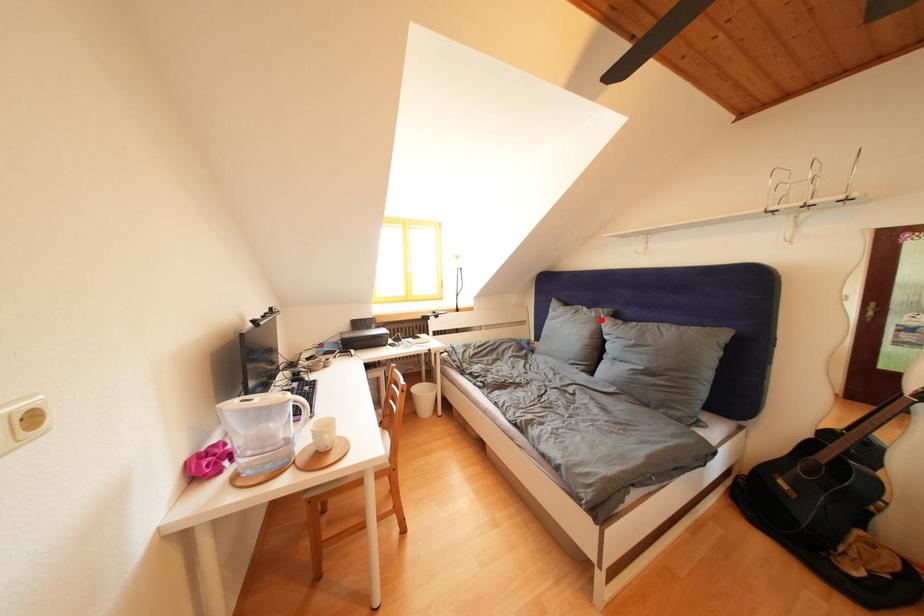
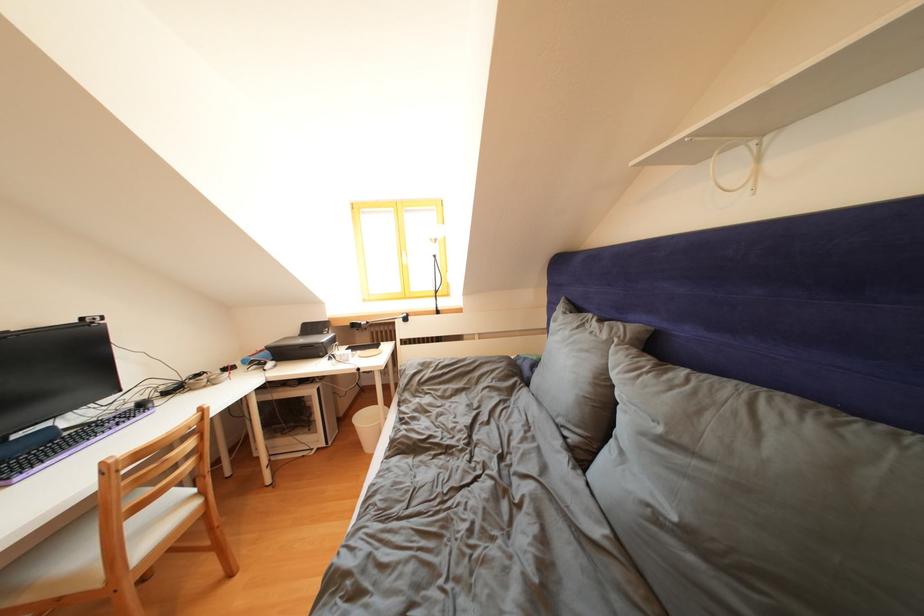
Question: I am providing you with two images of the same scene from different viewpoints. A red point is marked on the first image. At the location where the point appears in image 1, is it still visible in image 2?

Choices:
 (A) Yes
 (B) No

Answer: (A)